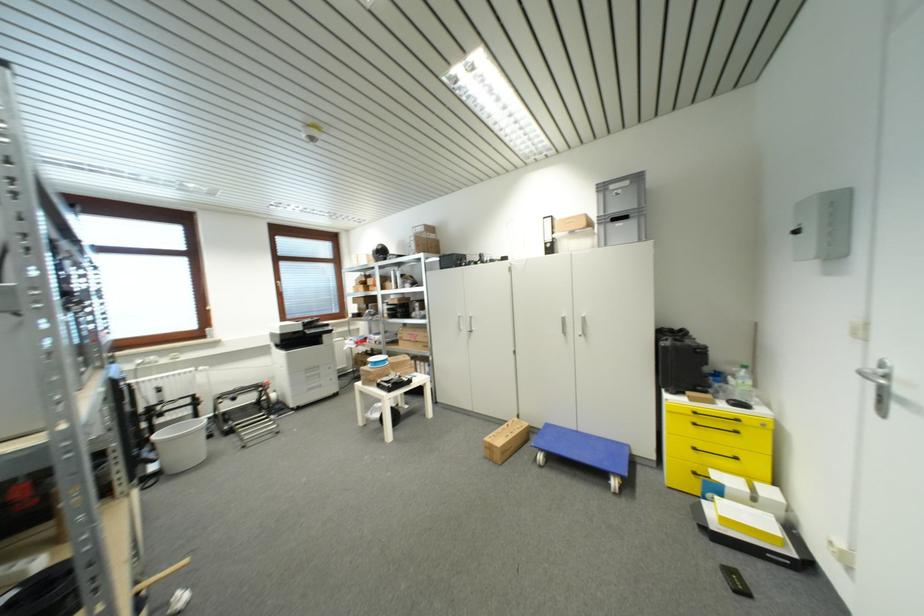
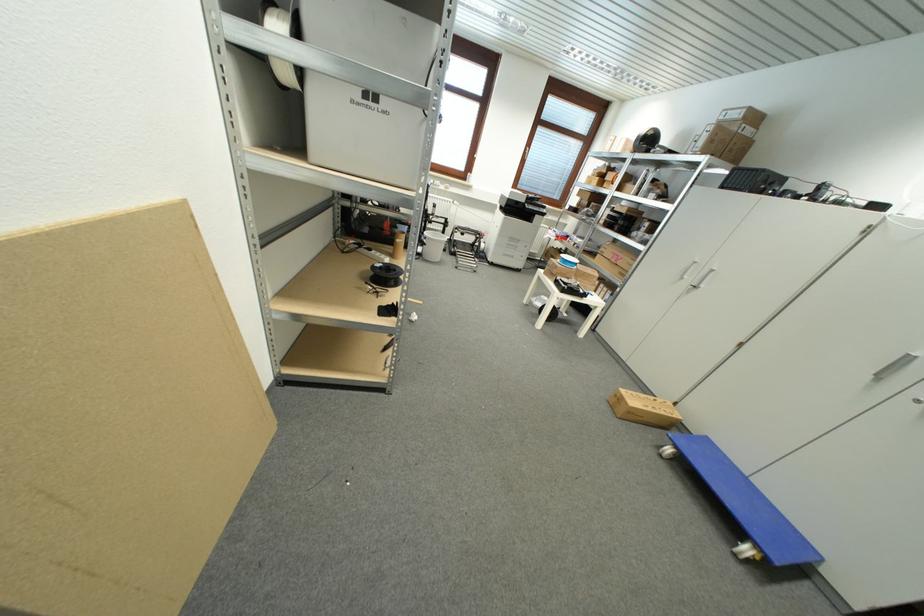
Where in the second image is the point corresponding to (x=514, y=426) from the first image?

(663, 402)